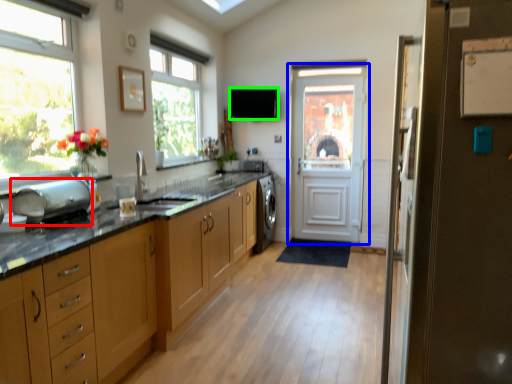
Question: Considering the real-world distances, which object is closest to appliance (highlighted by a red box)? door (highlighted by a blue box) or exhaust hood (highlighted by a green box).

Choices:
 (A) door
 (B) exhaust hood

Answer: (B)